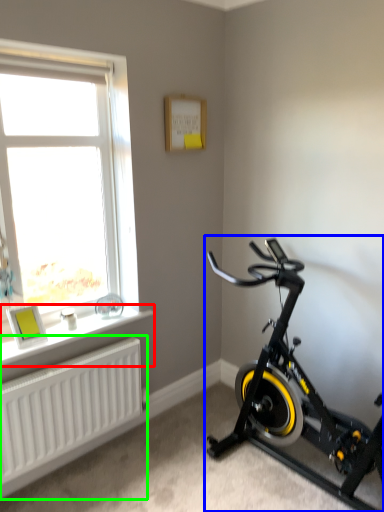
Question: Which object is positioned farthest from window sill (highlighted by a red box)? Select from stationary bicycle (highlighted by a blue box) and radiator (highlighted by a green box).

Choices:
 (A) stationary bicycle
 (B) radiator

Answer: (A)